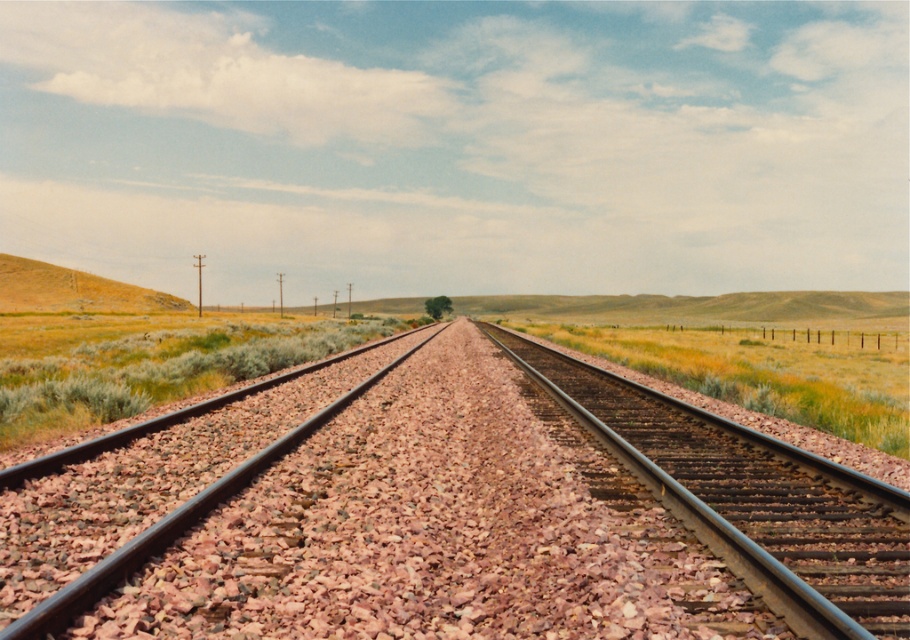
Question: Which point is closer to the camera?

Choices:
 (A) [447, 484]
 (B) [613, 451]

Answer: (A)

Question: Does metal/smooth train tracks at center lie behind metal/smooth train track at center?

Choices:
 (A) yes
 (B) no

Answer: (A)

Question: Does metal/smooth train tracks at center have a larger size compared to metal/smooth train track at center?

Choices:
 (A) yes
 (B) no

Answer: (A)

Question: Where is metal/smooth train tracks at center located in relation to metal/smooth train track at center in the image?

Choices:
 (A) above
 (B) below

Answer: (B)